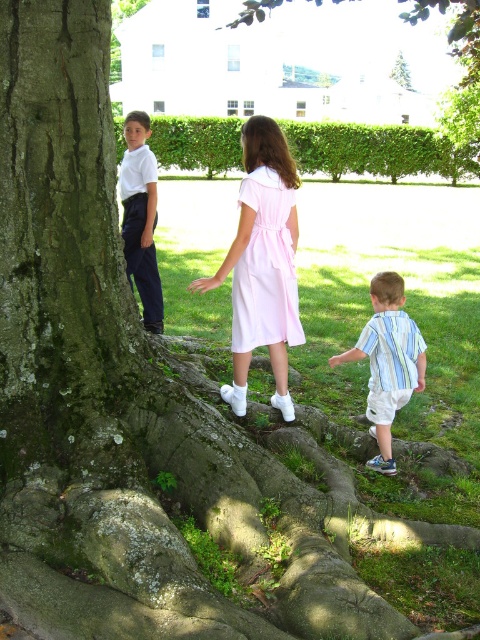
You are a photographer positioned at the center of the scene. You want to capture a photo that includes both the striped cotton shirt at lower right and the large tree with exposed roots. Which direction should you move to ensure both are in frame?

The striped cotton shirt at lower right is located at point (x=387, y=362). To include both the large tree with exposed roots and the striped cotton shirt at lower right in the frame, you should move towards the lower right direction to adjust your position so that both elements are within the camera view.

You are a photographer wanting to capture a photo of the striped cotton shirt at lower right and the green mossy tree trunk at upper center in the same frame. Given that your camera has a maximum focal length that allows capturing objects within a 10 meter distance apart, will you be able to include both in the shot?

The distance between the striped cotton shirt at lower right and the green mossy tree trunk at upper center is 10.26 meters, which exceeds the camera maximum focal length of 10 meters. Therefore, you cannot capture both in the same frame.

You are a photographer trying to capture a photo of the green mossy tree trunk at upper center and the pink cotton dress at center. Based on their positions, which object should you focus on first to ensure both are in the frame?

The pink cotton dress at center is below the green mossy tree trunk at upper center, so you should focus on the green mossy tree trunk at upper center first to ensure both are in the frame.